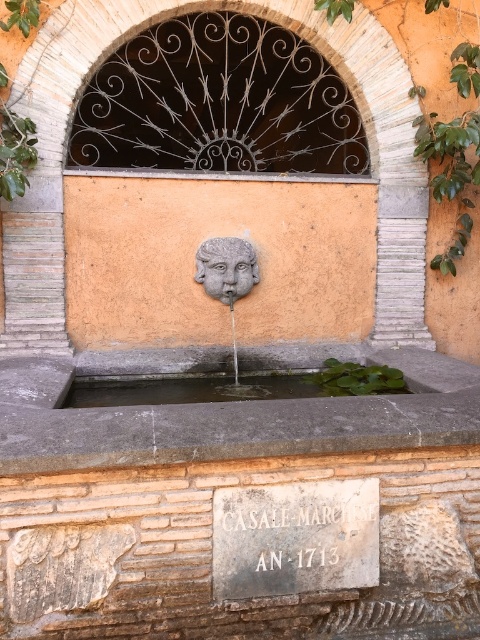
Question: Which point is farther to the camera?

Choices:
 (A) (72, 396)
 (B) (144, 77)
 (C) (463, 154)
 (D) (227, 572)

Answer: (C)

Question: Which point is closer to the camera taking this photo?

Choices:
 (A) (452, 160)
 (B) (245, 260)
 (C) (87, 83)

Answer: (C)

Question: Is dark wrought iron arch at upper center to the right of clear water at center from the viewer's perspective?

Choices:
 (A) no
 (B) yes

Answer: (A)

Question: Is dark wrought iron arch at upper center below matte stone face at center?

Choices:
 (A) yes
 (B) no

Answer: (B)

Question: Which object appears closest to the camera in this image?

Choices:
 (A) green leafy ivy at upper right
 (B) clear water at center

Answer: (B)

Question: Considering the relative positions of green leafy ivy at upper right and matte stone face at center in the image provided, where is green leafy ivy at upper right located with respect to matte stone face at center?

Choices:
 (A) above
 (B) below

Answer: (A)